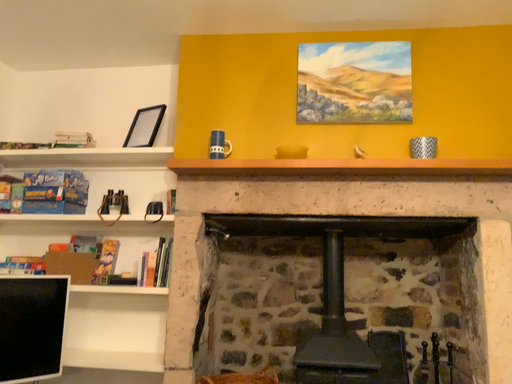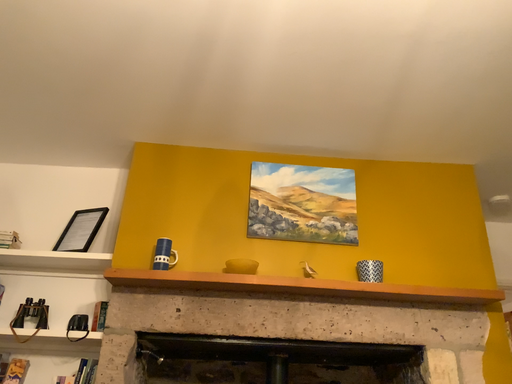
Question: How did the camera likely rotate when shooting the video?

Choices:
 (A) rotated downward
 (B) rotated upward

Answer: (B)